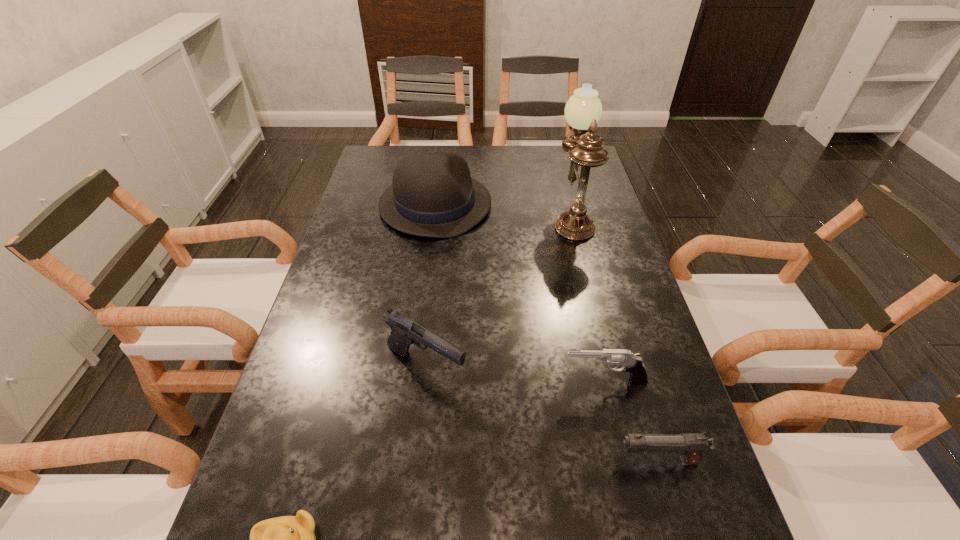
Find the location of a particular element. The height and width of the screenshot is (540, 960). free space that satisfies the following two spatial constraints: 1. on the front side of the tallest object; 2. at the muzzle of the third tallest object is located at coordinates [610, 367].